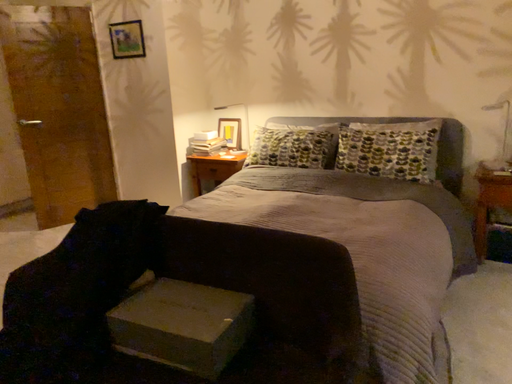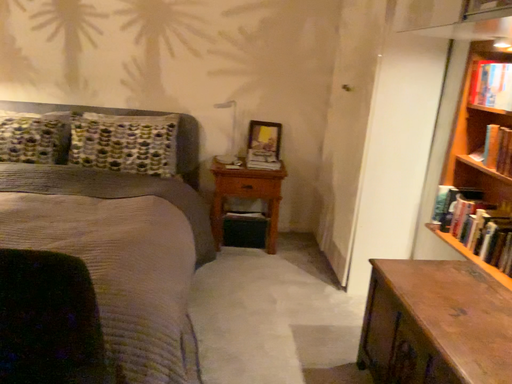
Question: How did the camera likely rotate when shooting the video?

Choices:
 (A) rotated right
 (B) rotated left

Answer: (A)